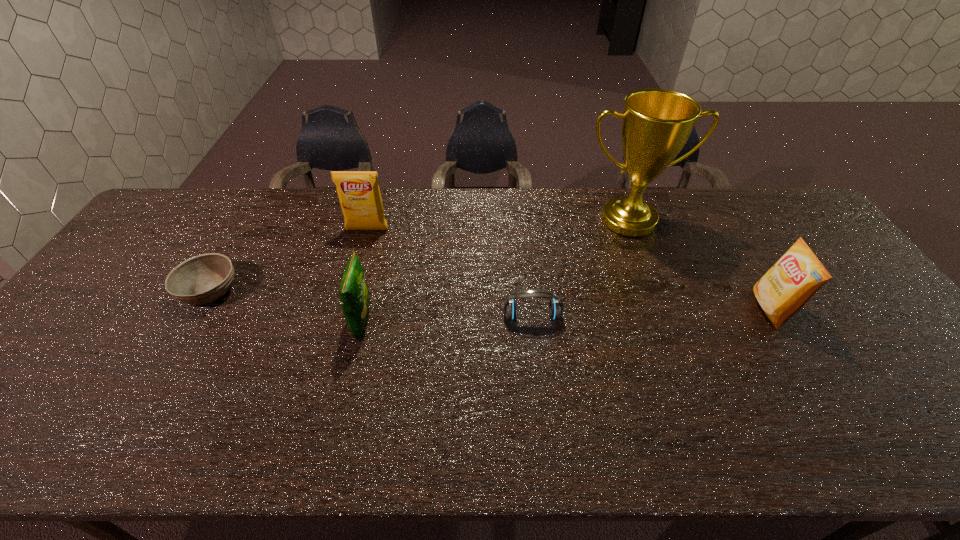
Where is `award`? This screenshot has height=540, width=960. award is located at coordinates pyautogui.click(x=656, y=123).

Find the location of a particular element. Image resolution: width=960 pixels, height=540 pixels. the fifth object from left to right is located at coordinates (656, 123).

At what (x,y) coordinates should I click in order to perform the action: click on the farthest crisp (potato chip). Please return your answer as a coordinate pair (x, y). The height and width of the screenshot is (540, 960). Looking at the image, I should click on (359, 194).

Locate an element on the screen. the rightmost crisp (potato chip) is located at coordinates (790, 283).

The image size is (960, 540). In order to click on the fifth tallest object in this screenshot , I will do `click(555, 308)`.

Locate an element on the screen. headset is located at coordinates (555, 308).

I want to click on bowl, so (x=202, y=279).

Where is `the leftmost object`? This screenshot has width=960, height=540. the leftmost object is located at coordinates (202, 279).

This screenshot has width=960, height=540. What are the coordinates of `free space located by the handles of the tallest object` in the screenshot? It's located at [664, 317].

At what (x,y) coordinates should I click in order to perform the action: click on free space located on the front of the farthest crisp (potato chip) with the logo. Please return your answer as a coordinate pair (x, y). Image resolution: width=960 pixels, height=540 pixels. Looking at the image, I should click on (363, 245).